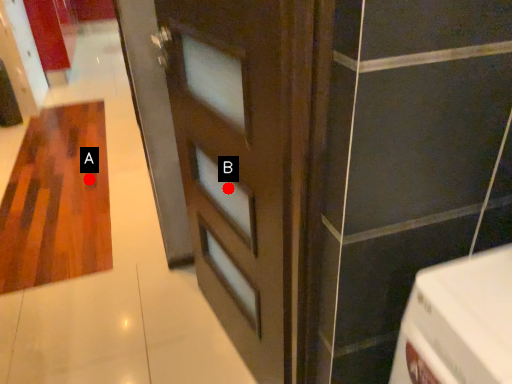
Question: Two points are circled on the image, labeled by A and B beside each circle. Which point is closer to the camera?

Choices:
 (A) A is closer
 (B) B is closer

Answer: (B)